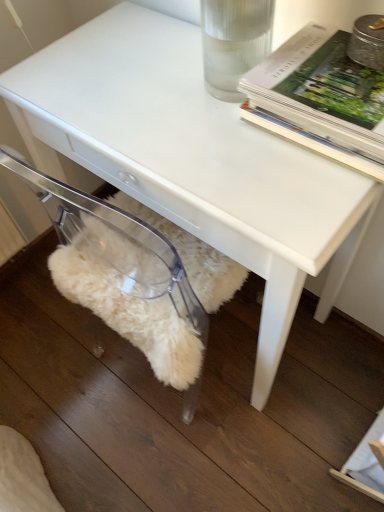
Locate an element on the screen. The image size is (384, 512). blank space to the left of hardcover book at upper right is located at coordinates (205, 129).